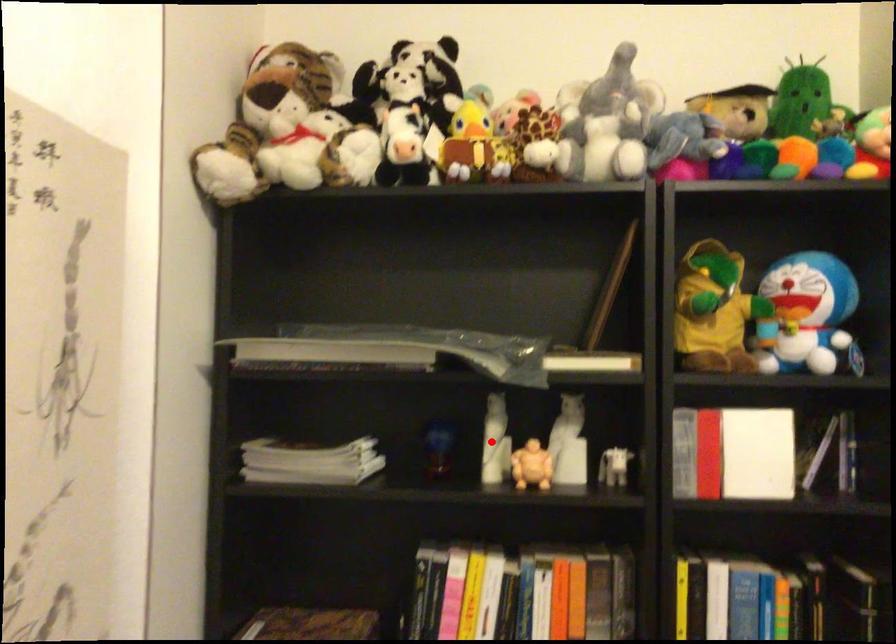
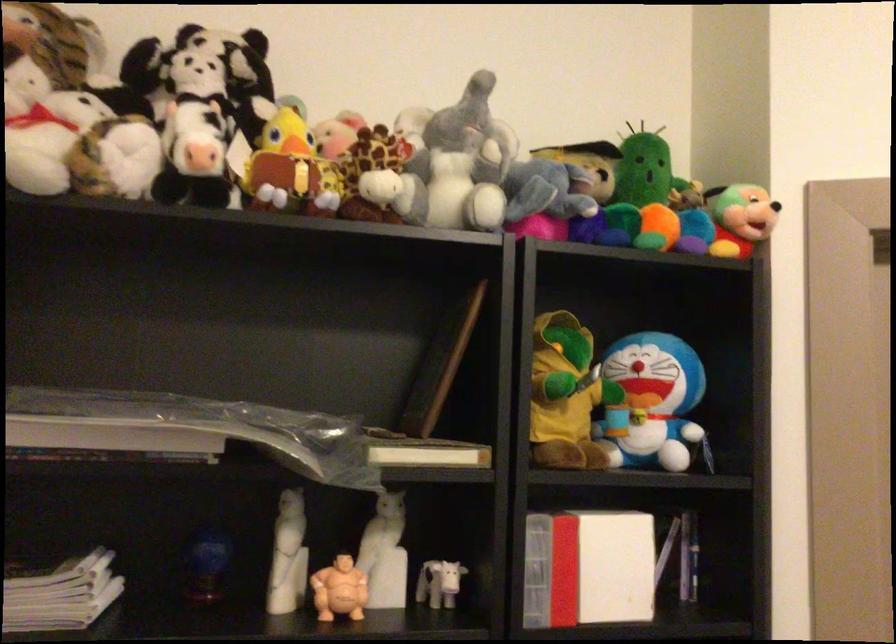
Where in the second image is the point corresponding to the highlighted location from the first image?

(288, 556)